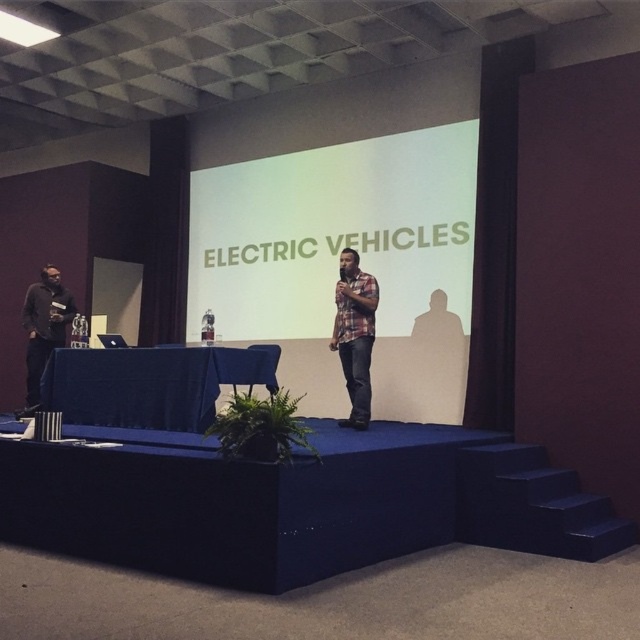
Does point (392, 141) lie behind point (330, 349)?

Yes, it is behind point (330, 349).

Can you confirm if white matte projection screen at center is positioned below plaid shirt at center?

Incorrect, white matte projection screen at center is not positioned below plaid shirt at center.

Image resolution: width=640 pixels, height=640 pixels. What are the coordinates of `white matte projection screen at center` in the screenshot? It's located at (333, 234).

Find the location of a particular element. The width and height of the screenshot is (640, 640). plaid shirt at center is located at coordinates (355, 333).

Does plaid shirt at center appear under matte black shirt at left?

No.

The image size is (640, 640). What do you see at coordinates (355, 333) in the screenshot?
I see `plaid shirt at center` at bounding box center [355, 333].

Locate an element on the screen. This screenshot has width=640, height=640. plaid shirt at center is located at coordinates (355, 333).

Can you confirm if white matte projection screen at center is positioned to the right of matte black shirt at left?

Yes, white matte projection screen at center is to the right of matte black shirt at left.

Can you confirm if white matte projection screen at center is positioned below matte black shirt at left?

No.

Describe the element at coordinates (333, 234) in the screenshot. The height and width of the screenshot is (640, 640). I see `white matte projection screen at center` at that location.

Identify the location of white matte projection screen at center. coord(333,234).